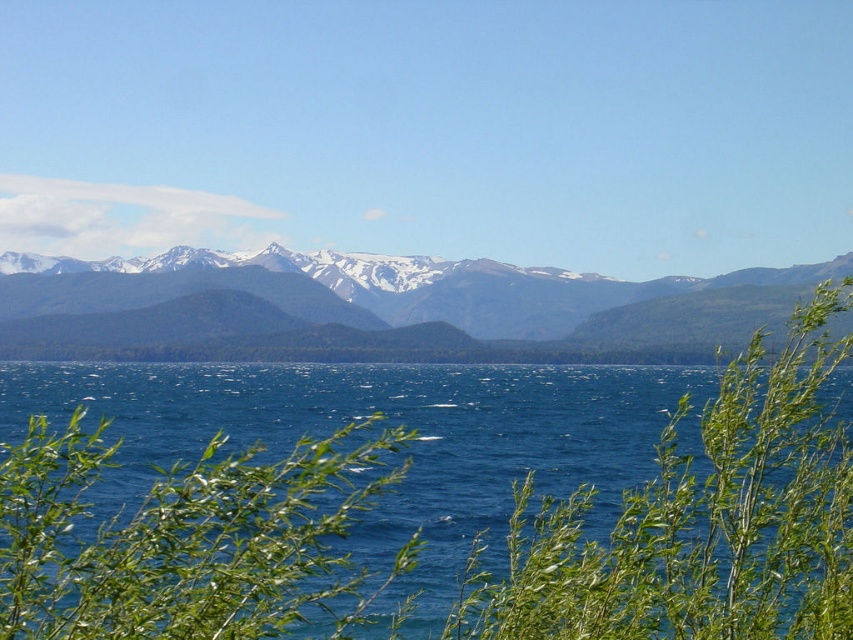
Can you confirm if smokey gray mountains at center is thinner than blue liquid water at center?

No.

Who is positioned more to the right, smokey gray mountains at center or blue liquid water at center?

smokey gray mountains at center

Does point (265, 310) lie behind point (450, 516)?

Yes, it is.

The image size is (853, 640). Find the location of `smokey gray mountains at center`. smokey gray mountains at center is located at coordinates (386, 310).

Is point (172, 320) closer to camera compared to point (86, 636)?

No, it is not.

Is point (415, 301) farther from viewer compared to point (99, 624)?

Yes.

Which is in front, point (492, 326) or point (67, 464)?

Point (67, 464) is in front.

I want to click on smokey gray mountains at center, so click(x=386, y=310).

Which of these two, green leafy plant at center or smokey gray mountains at center, stands taller?

With more height is smokey gray mountains at center.

Which is in front, point (782, 388) or point (236, 308)?

Point (782, 388)

Where is `green leafy plant at center`? green leafy plant at center is located at coordinates (699, 518).